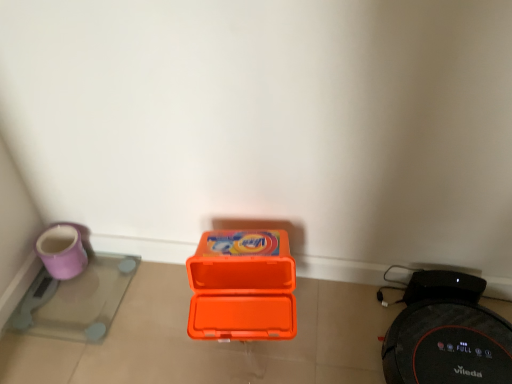
Question: Is orange plastic box at center surrounded by black rubber robot vacuum cleaner at lower right, the second appliance in the left-to-right sequence?

Choices:
 (A) no
 (B) yes

Answer: (A)

Question: Is black rubber robot vacuum cleaner at lower right, the second appliance in the left-to-right sequence, not within orange plastic box at center?

Choices:
 (A) yes
 (B) no

Answer: (A)

Question: From the image's perspective, does black rubber robot vacuum cleaner at lower right, the second appliance in the left-to-right sequence, appear lower than orange plastic box at center?

Choices:
 (A) no
 (B) yes

Answer: (B)

Question: Considering the relative positions of black rubber robot vacuum cleaner at lower right, the second appliance in the left-to-right sequence, and orange plastic box at center in the image provided, is black rubber robot vacuum cleaner at lower right, the second appliance in the left-to-right sequence, to the right of orange plastic box at center from the viewer's perspective?

Choices:
 (A) yes
 (B) no

Answer: (A)

Question: Is black rubber robot vacuum cleaner at lower right, the second appliance in the left-to-right sequence, next to orange plastic box at center?

Choices:
 (A) no
 (B) yes

Answer: (A)

Question: Considering the relative sizes of black rubber robot vacuum cleaner at lower right, the second appliance in the left-to-right sequence, and orange plastic box at center in the image provided, is black rubber robot vacuum cleaner at lower right, the second appliance in the left-to-right sequence, shorter than orange plastic box at center?

Choices:
 (A) yes
 (B) no

Answer: (A)

Question: Is purple glossy scale at lower left, the second appliance when ordered from right to left, facing away from orange plastic box at center?

Choices:
 (A) yes
 (B) no

Answer: (B)

Question: Considering the relative positions of purple glossy scale at lower left, the first appliance viewed from the left, and orange plastic box at center in the image provided, is purple glossy scale at lower left, the first appliance viewed from the left, to the left of orange plastic box at center from the viewer's perspective?

Choices:
 (A) no
 (B) yes

Answer: (B)

Question: Is purple glossy scale at lower left, the first appliance viewed from the left, further to camera compared to orange plastic box at center?

Choices:
 (A) no
 (B) yes

Answer: (B)

Question: Considering the relative sizes of purple glossy scale at lower left, the second appliance when ordered from right to left, and orange plastic box at center in the image provided, is purple glossy scale at lower left, the second appliance when ordered from right to left, wider than orange plastic box at center?

Choices:
 (A) yes
 (B) no

Answer: (A)

Question: Is there a large distance between purple glossy scale at lower left, the second appliance when ordered from right to left, and orange plastic box at center?

Choices:
 (A) no
 (B) yes

Answer: (A)

Question: From a real-world perspective, is purple glossy scale at lower left, the first appliance viewed from the left, under orange plastic box at center?

Choices:
 (A) yes
 (B) no

Answer: (A)

Question: Is orange plastic box at center shorter than purple glossy scale at lower left, the second appliance when ordered from right to left?

Choices:
 (A) no
 (B) yes

Answer: (A)